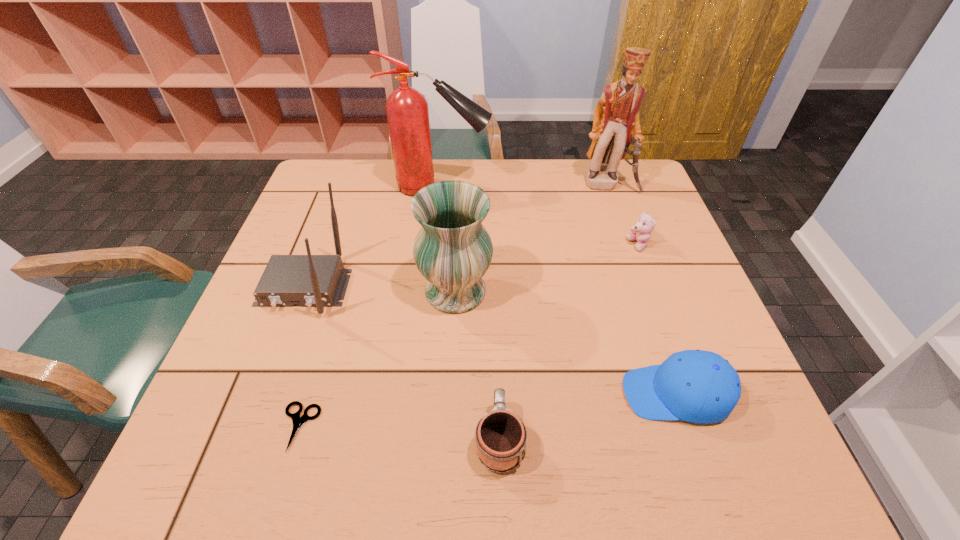
Find the location of a particular element. The image size is (960, 540). vacant space that satisfies the following two spatial constraints: 1. at the nozzle end of the fire extinguisher; 2. on the left side of the vase is located at coordinates (428, 291).

You are a GUI agent. You are given a task and a screenshot of the screen. Output one action in this format:
    pyautogui.click(x=<x>, y=<y>)
    Task: Click on the free space that satisfies the following two spatial constraints: 1. on the side of the seventh tallest object with the handle; 2. at the nozzle end of the fire extinguisher
    
    Given the screenshot: What is the action you would take?
    pyautogui.click(x=492, y=187)

Locate an element on the screen. Image resolution: width=960 pixels, height=540 pixels. free spot that satisfies the following two spatial constraints: 1. at the face of the third farthest object; 2. on the back of the router to connect cables is located at coordinates (654, 287).

Locate an element on the screen. vacant position in the image that satisfies the following two spatial constraints: 1. on the front-facing side of the nutcracker; 2. on the front-facing side of the cap is located at coordinates (682, 394).

Where is `free spot that satisfies the following two spatial constraints: 1. at the face of the teddy bear; 2. on the front side of the vase`? free spot that satisfies the following two spatial constraints: 1. at the face of the teddy bear; 2. on the front side of the vase is located at coordinates (656, 291).